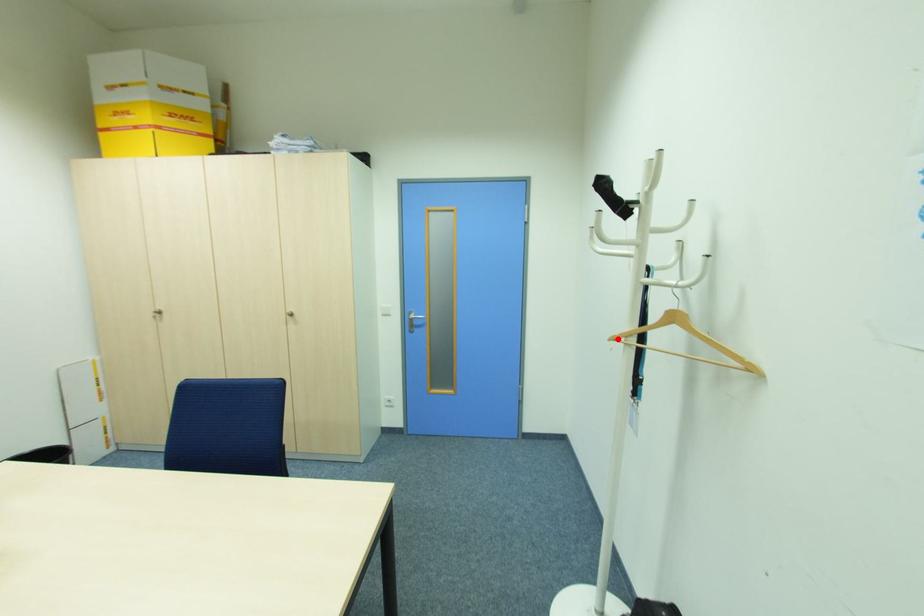
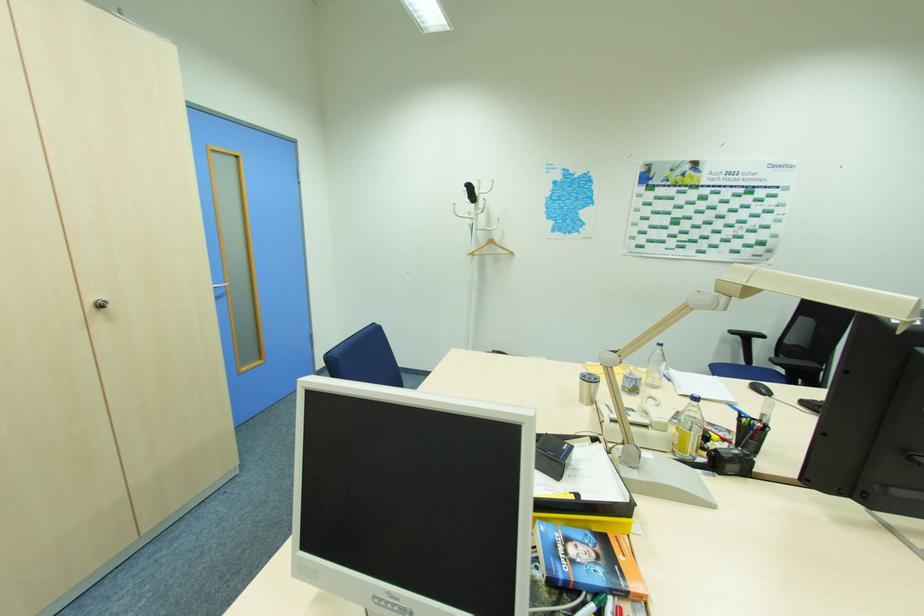
Where in the second image is the point corresponding to the highlighted location from the first image?

(472, 254)